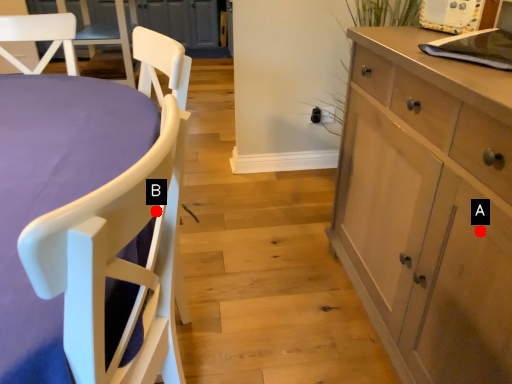
Question: Two points are circled on the image, labeled by A and B beside each circle. Which of the following is the farthest from the observer?

Choices:
 (A) A is further
 (B) B is further

Answer: (A)